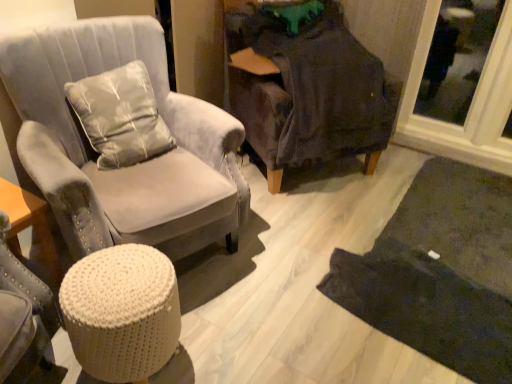
Question: Is dark gray fabric chair at center, marked as the 1th chair in a right-to-left arrangement, inside or outside of satin-like gray pillow at upper left?

Choices:
 (A) inside
 (B) outside

Answer: (B)

Question: In terms of width, does dark gray fabric chair at center, marked as the 1th chair in a right-to-left arrangement, look wider or thinner when compared to satin-like gray pillow at upper left?

Choices:
 (A) thin
 (B) wide

Answer: (B)

Question: Considering the real-world distances, which object is closest to the satin-like gray pillow at upper left?

Choices:
 (A) suede gray armchair at left, which is the 2th chair in right-to-left order
 (B) dark gray textured mat at lower right
 (C) dark gray fabric chair at center, acting as the second chair starting from the left
 (D) transparent glass door at upper right
 (E) white knitted stool at lower left

Answer: (A)

Question: Estimate the real-world distances between objects in this image. Which object is farther from the white knitted stool at lower left?

Choices:
 (A) satin-like gray pillow at upper left
 (B) dark gray textured mat at lower right
 (C) dark gray fabric chair at center, marked as the 1th chair in a right-to-left arrangement
 (D) suede gray armchair at left, which is the 2th chair in right-to-left order
 (E) transparent glass door at upper right

Answer: (E)